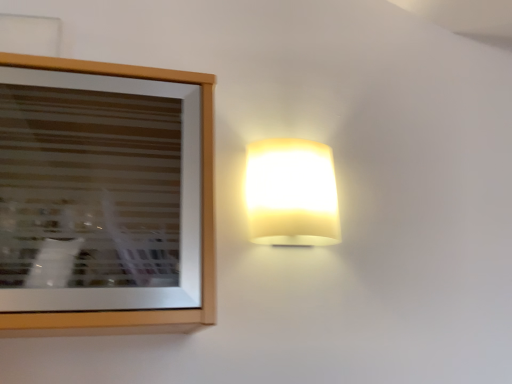
Question: Looking at the image, does matte yellow glass lamp at upper right seem bigger or smaller compared to wooden picture frame at upper left?

Choices:
 (A) big
 (B) small

Answer: (B)

Question: Choose the correct answer: Is matte yellow glass lamp at upper right inside wooden picture frame at upper left or outside it?

Choices:
 (A) inside
 (B) outside

Answer: (B)

Question: Considering the positions of matte yellow glass lamp at upper right and wooden picture frame at upper left in the image, is matte yellow glass lamp at upper right taller or shorter than wooden picture frame at upper left?

Choices:
 (A) short
 (B) tall

Answer: (A)

Question: Is wooden picture frame at upper left inside or outside of matte yellow glass lamp at upper right?

Choices:
 (A) inside
 (B) outside

Answer: (B)

Question: From the image's perspective, is wooden picture frame at upper left above or below matte yellow glass lamp at upper right?

Choices:
 (A) above
 (B) below

Answer: (B)

Question: Relative to matte yellow glass lamp at upper right, is wooden picture frame at upper left in front or behind?

Choices:
 (A) behind
 (B) front

Answer: (B)

Question: From a real-world perspective, relative to matte yellow glass lamp at upper right, is wooden picture frame at upper left vertically above or below?

Choices:
 (A) above
 (B) below

Answer: (B)